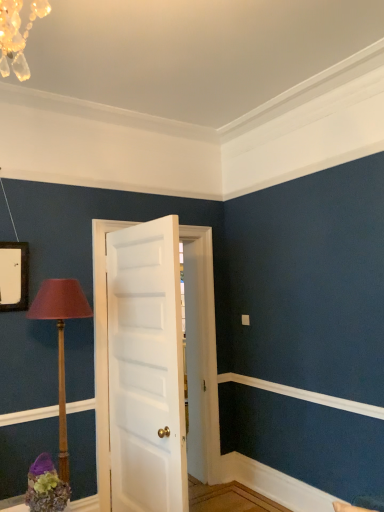
Question: From a real-world perspective, is white matte door at center over wooden table lamp at left?

Choices:
 (A) yes
 (B) no

Answer: (A)

Question: Does white matte door at center have a lesser width compared to wooden table lamp at left?

Choices:
 (A) yes
 (B) no

Answer: (A)

Question: Does white matte door at center have a larger size compared to wooden table lamp at left?

Choices:
 (A) no
 (B) yes

Answer: (B)

Question: Is white matte door at center further to camera compared to wooden table lamp at left?

Choices:
 (A) no
 (B) yes

Answer: (B)

Question: Are white matte door at center and wooden table lamp at left located far from each other?

Choices:
 (A) no
 (B) yes

Answer: (A)

Question: Can you confirm if white matte door at center is positioned to the right of wooden table lamp at left?

Choices:
 (A) yes
 (B) no

Answer: (A)

Question: Can you confirm if wooden table lamp at left is smaller than white matte door at center?

Choices:
 (A) yes
 (B) no

Answer: (A)

Question: From a real-world perspective, is wooden table lamp at left physically above white matte door at center?

Choices:
 (A) yes
 (B) no

Answer: (B)

Question: Does wooden table lamp at left have a greater width compared to white matte door at center?

Choices:
 (A) no
 (B) yes

Answer: (B)

Question: Does wooden table lamp at left have a lesser width compared to white matte door at center?

Choices:
 (A) no
 (B) yes

Answer: (A)

Question: From the image's perspective, is wooden table lamp at left beneath white matte door at center?

Choices:
 (A) no
 (B) yes

Answer: (B)

Question: Is wooden table lamp at left at the left side of white matte door at center?

Choices:
 (A) no
 (B) yes

Answer: (B)

Question: Considering their positions, is wooden table lamp at left located in front of or behind white matte door at center?

Choices:
 (A) behind
 (B) front

Answer: (B)